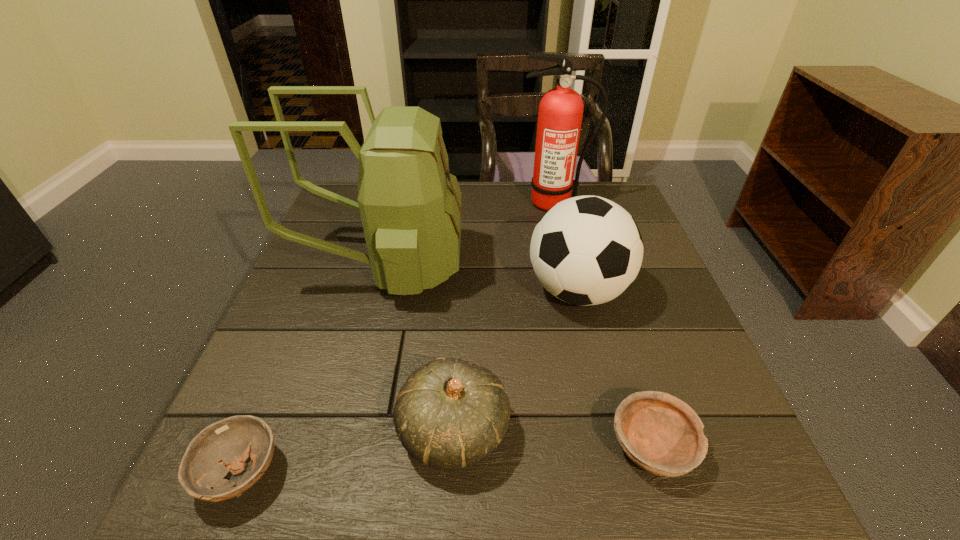
This screenshot has height=540, width=960. I want to click on vacant region located on the back of the left bowl, so click(269, 406).

Find the location of a particular element. The height and width of the screenshot is (540, 960). vacant space located 0.370m on the back of the right bowl is located at coordinates (600, 278).

Locate an element on the screen. This screenshot has height=540, width=960. object located in the far edge section of the desktop is located at coordinates (560, 114).

Find the location of a particular element. Image resolution: width=960 pixels, height=540 pixels. gourd at the near edge is located at coordinates (450, 414).

Locate an element on the screen. This screenshot has height=540, width=960. backpack at the left edge is located at coordinates (410, 205).

Where is `bowl located at the left edge`? The image size is (960, 540). bowl located at the left edge is located at coordinates (224, 446).

At what (x,y) coordinates should I click in order to perform the action: click on fire extinguisher located at the right edge. Please return your answer as a coordinate pair (x, y). Image resolution: width=960 pixels, height=540 pixels. Looking at the image, I should click on (560, 114).

Image resolution: width=960 pixels, height=540 pixels. Find the location of `soccer ball situated at the right edge`. soccer ball situated at the right edge is located at coordinates (587, 250).

This screenshot has height=540, width=960. Identify the location of bowl positioned at the right edge. (660, 433).

Locate an element on the screen. The width and height of the screenshot is (960, 540). object that is at the near left corner is located at coordinates (224, 446).